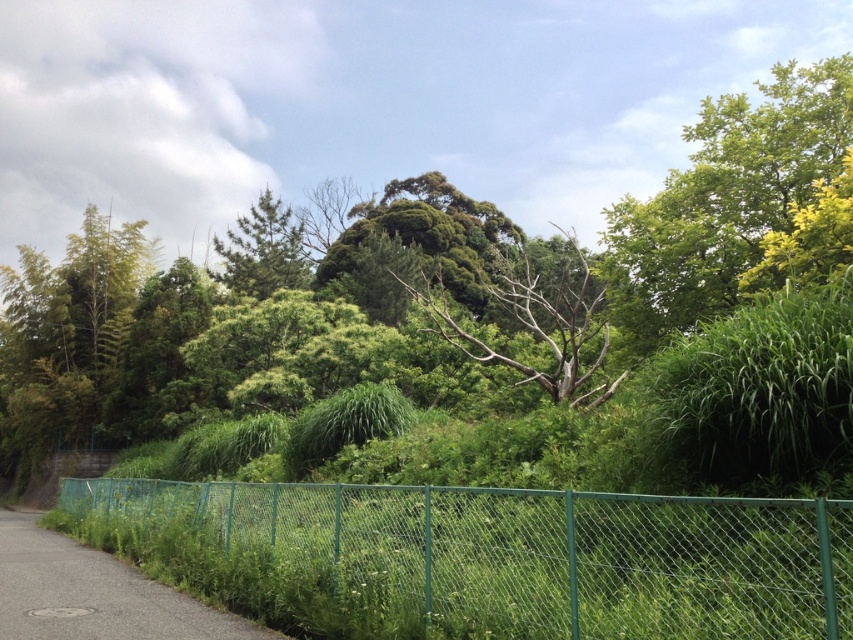
You are standing at the edge of the teal fence in the image. You see an asphalt road at lower left and a bare wood tree at center. Which object appears closer to you based on their sizes?

The asphalt road at lower left is smaller than the bare wood tree at center, so the bare wood tree at center appears closer to you since smaller objects in the foreground can sometimes appear closer, but in this case, the description states the road is smaller, so it might be farther away. Wait, there might be confusion here. Let me think again. If the road is smaller than the tree, but the road is at lower left which is in the foreground, maybe the description is indicating that despite being in the lower,